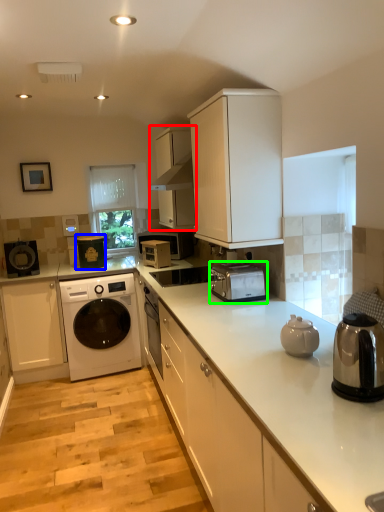
Question: Estimate the real-world distances between objects in this image. Which object is closer to cabinetry (highlighted by a red box), appliance (highlighted by a blue box) or toaster (highlighted by a green box)?

Choices:
 (A) appliance
 (B) toaster

Answer: (B)